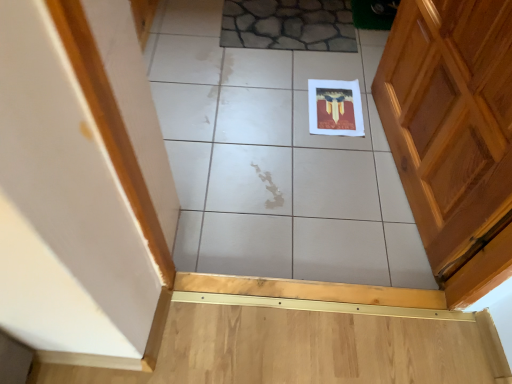
Question: From their relative heights in the image, would you say white glossy tile at center, which is counted as the 2th ceramic tile, starting from the top, is taller or shorter than stone-like ceramic tile at upper center, positioned as the 2th ceramic tile in bottom-to-top order?

Choices:
 (A) short
 (B) tall

Answer: (B)

Question: Is white glossy tile at center, which is counted as the 2th ceramic tile, starting from the top, inside the boundaries of stone-like ceramic tile at upper center, the 1th ceramic tile from the top, or outside?

Choices:
 (A) outside
 (B) inside

Answer: (A)

Question: Based on their sizes in the image, would you say white glossy tile at center, which is counted as the 2th ceramic tile, starting from the top, is bigger or smaller than stone-like ceramic tile at upper center, the 1th ceramic tile from the top?

Choices:
 (A) small
 (B) big

Answer: (B)

Question: From a real-world perspective, is stone-like ceramic tile at upper center, positioned as the 2th ceramic tile in bottom-to-top order, above or below white glossy tile at center, placed as the 1th ceramic tile when sorted from bottom to top?

Choices:
 (A) above
 (B) below

Answer: (A)

Question: Is point (293, 34) positioned closer to the camera than point (219, 173)?

Choices:
 (A) farther
 (B) closer

Answer: (A)

Question: Looking at their shapes, would you say stone-like ceramic tile at upper center, positioned as the 2th ceramic tile in bottom-to-top order, is wider or thinner than white glossy tile at center, placed as the 1th ceramic tile when sorted from bottom to top?

Choices:
 (A) wide
 (B) thin

Answer: (B)

Question: Relative to white glossy tile at center, which is counted as the 2th ceramic tile, starting from the top, is stone-like ceramic tile at upper center, positioned as the 2th ceramic tile in bottom-to-top order, in front or behind?

Choices:
 (A) behind
 (B) front

Answer: (A)